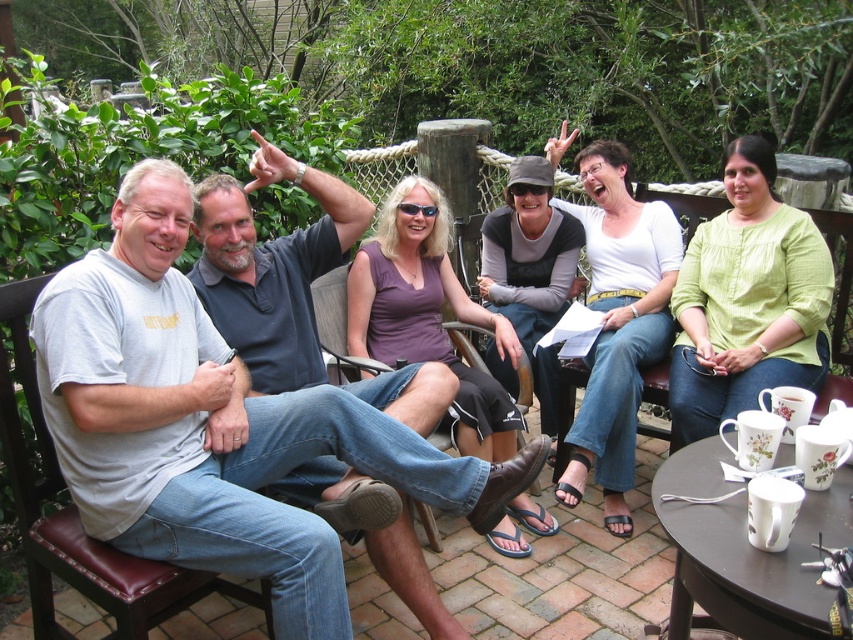
Which is above, gray t-shirt at left or brown leather chair at center?

brown leather chair at center is higher up.

How much distance is there between gray t-shirt at left and brown leather chair at center?

gray t-shirt at left and brown leather chair at center are 32.04 inches apart from each other.

Who is more forward, (218,372) or (325,326)?

Positioned in front is point (218,372).

You are a GUI agent. You are given a task and a screenshot of the screen. Output one action in this format:
    pyautogui.click(x=<x>, y=<y>)
    Task: Click on the gray t-shirt at left
    This screenshot has height=640, width=853.
    Given the screenshot: What is the action you would take?
    pyautogui.click(x=236, y=433)

Is brown leather chair at left to the left of brown leather chair at center from the viewer's perspective?

Yes, brown leather chair at left is to the left of brown leather chair at center.

Who is positioned more to the right, brown leather chair at left or brown leather chair at center?

brown leather chair at center is more to the right.

Is point (82, 570) positioned after point (317, 312)?

No.

At what (x,y) coordinates should I click in order to perform the action: click on brown leather chair at left. Please return your answer as a coordinate pair (x, y). The width and height of the screenshot is (853, 640). Looking at the image, I should click on (78, 518).

Is gray t-shirt at left thinner than brown leather chair at left?

No.

Is gray t-shirt at left taller than brown leather chair at left?

Yes.

Where is `gray t-shirt at left`? gray t-shirt at left is located at coordinates (236, 433).

The image size is (853, 640). Identify the location of gray t-shirt at left. (236, 433).